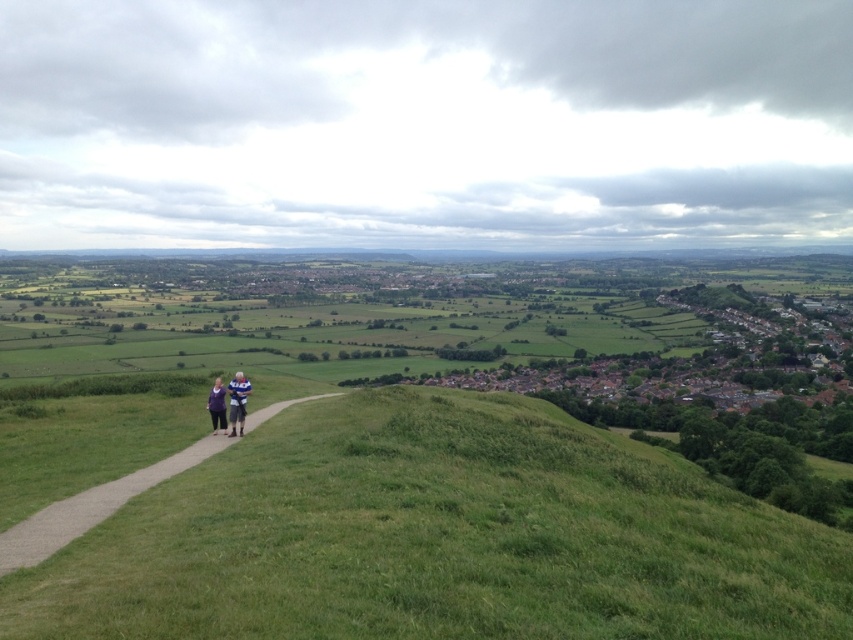
Question: Which object is positioned farthest from the green grassy hillside at center?

Choices:
 (A) purple fabric at center
 (B) gravel path at center

Answer: (A)

Question: Which of the following is the closest to the observer?

Choices:
 (A) purple fabric at center
 (B) green grassy hillside at center

Answer: (B)

Question: Does green grassy hillside at center have a greater width compared to gravel path at center?

Choices:
 (A) yes
 (B) no

Answer: (A)

Question: Is green grassy hillside at center to the left of blue fabric shirt at center from the viewer's perspective?

Choices:
 (A) no
 (B) yes

Answer: (A)

Question: Can you confirm if gravel path at center is bigger than purple fabric at center?

Choices:
 (A) no
 (B) yes

Answer: (A)

Question: Which of the following is the closest to the observer?

Choices:
 (A) (250, 426)
 (B) (221, 422)
 (C) (242, 387)
 (D) (666, 506)

Answer: (D)